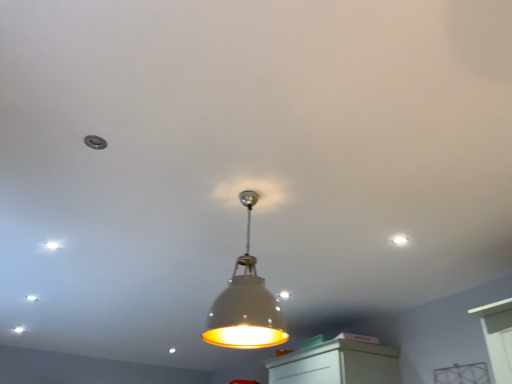
Question: Is white matte lampshade at center to the right of white matte light fixture at upper center, positioned as the 2th dot in left-to-right order, from the viewer's perspective?

Choices:
 (A) yes
 (B) no

Answer: (B)

Question: Is white matte lampshade at center far from white matte light fixture at upper center, arranged as the 2th dot when viewed from the back?

Choices:
 (A) no
 (B) yes

Answer: (B)

Question: From a real-world perspective, is white matte lampshade at center over white matte light fixture at upper center, the 2th dot from the bottom?

Choices:
 (A) yes
 (B) no

Answer: (B)

Question: From a real-world perspective, is white matte lampshade at center positioned under white matte light fixture at upper center, the 2th dot from the bottom, based on gravity?

Choices:
 (A) yes
 (B) no

Answer: (A)

Question: Considering the relative sizes of white matte lampshade at center and white matte light fixture at upper center, the 1th dot when ordered from right to left, in the image provided, is white matte lampshade at center wider than white matte light fixture at upper center, the 1th dot when ordered from right to left,?

Choices:
 (A) yes
 (B) no

Answer: (A)

Question: Does white matte lampshade at center come behind white matte light fixture at upper center, arranged as the 2th dot when viewed from the back?

Choices:
 (A) no
 (B) yes

Answer: (A)

Question: Is white matte light fixture at upper center, the first dot when ordered from top to bottom, shorter than white matte lampshade at center?

Choices:
 (A) no
 (B) yes

Answer: (B)

Question: Is white matte light fixture at upper center, the 1th dot when ordered from right to left, smaller than white matte lampshade at center?

Choices:
 (A) no
 (B) yes

Answer: (B)

Question: Does white matte light fixture at upper center, arranged as the 2th dot when viewed from the back, turn towards white matte lampshade at center?

Choices:
 (A) no
 (B) yes

Answer: (B)

Question: Can you confirm if white matte light fixture at upper center, the 2th dot from the bottom, is bigger than white matte lampshade at center?

Choices:
 (A) no
 (B) yes

Answer: (A)

Question: Is white matte lampshade at center a part of white matte light fixture at upper center, arranged as the 2th dot when viewed from the back?

Choices:
 (A) yes
 (B) no

Answer: (B)

Question: From the image's perspective, would you say white matte light fixture at upper center, positioned as the 2th dot in left-to-right order, is shown under white matte lampshade at center?

Choices:
 (A) yes
 (B) no

Answer: (B)

Question: From a real-world perspective, is white glossy dot at upper left, the second dot viewed from the front, over white matte lampshade at center?

Choices:
 (A) no
 (B) yes

Answer: (B)